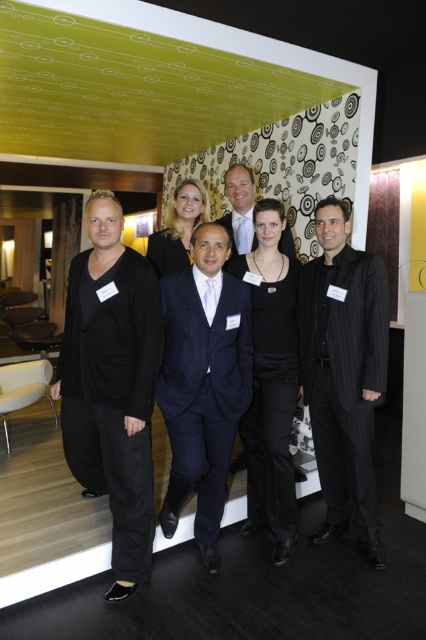
Does black matte suit at left appear under matte black dress at center?

Yes.

Can you confirm if black matte suit at left is smaller than matte black dress at center?

Actually, black matte suit at left might be larger than matte black dress at center.

In order to click on black matte suit at left in this screenshot , I will do `click(112, 385)`.

Does point (328, 436) lie in front of point (261, 454)?

Yes, point (328, 436) is in front of point (261, 454).

Between black pinstripe suit at right and black satin dress at center, which one is positioned lower?

Positioned lower is black satin dress at center.

Is point (370, 280) positioned behind point (293, 324)?

That is False.

Locate an element on the screen. This screenshot has height=640, width=426. black pinstripe suit at right is located at coordinates (344, 372).

Which is more to the left, black pinstripe suit at right or matte black suit at center?

From the viewer's perspective, matte black suit at center appears more on the left side.

Does black pinstripe suit at right appear over matte black suit at center?

No.

Is point (345, 244) behind point (290, 250)?

No, it is in front of (290, 250).

Identify the location of black pinstripe suit at right. (344, 372).